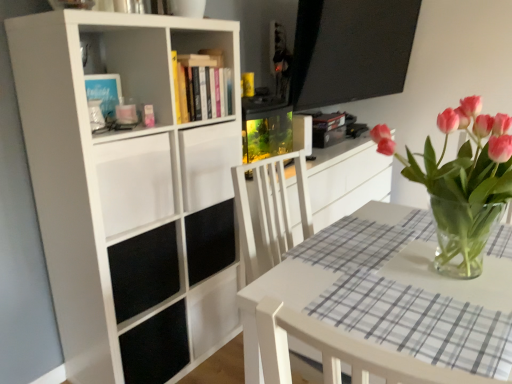
Question: Does hardcover books at upper center have a lesser width compared to white matte drawer at upper left?

Choices:
 (A) no
 (B) yes

Answer: (B)

Question: Is hardcover books at upper center further to the viewer compared to white matte drawer at upper left?

Choices:
 (A) yes
 (B) no

Answer: (A)

Question: Does hardcover books at upper center have a greater width compared to white matte drawer at upper left?

Choices:
 (A) no
 (B) yes

Answer: (A)

Question: Is white matte drawer at upper left inside hardcover books at upper center?

Choices:
 (A) no
 (B) yes

Answer: (A)

Question: Can you confirm if hardcover books at upper center is bigger than white matte drawer at upper left?

Choices:
 (A) yes
 (B) no

Answer: (B)

Question: Is hardcover books at upper center to the right of white matte drawer at upper left from the viewer's perspective?

Choices:
 (A) yes
 (B) no

Answer: (A)

Question: From the image's perspective, would you say white matte drawer at upper left is shown under hardcover books at upper center?

Choices:
 (A) yes
 (B) no

Answer: (A)

Question: Is white matte drawer at upper left placed right next to hardcover books at upper center?

Choices:
 (A) yes
 (B) no

Answer: (B)

Question: Would you consider white matte drawer at upper left to be distant from hardcover books at upper center?

Choices:
 (A) no
 (B) yes

Answer: (A)

Question: Is white matte drawer at upper left shorter than hardcover books at upper center?

Choices:
 (A) no
 (B) yes

Answer: (A)

Question: Can you confirm if white matte drawer at upper left is taller than hardcover books at upper center?

Choices:
 (A) no
 (B) yes

Answer: (B)

Question: Is white matte drawer at upper left at the left side of hardcover books at upper center?

Choices:
 (A) no
 (B) yes

Answer: (B)

Question: Does white matte bookcase at left have a greater width compared to pink glass vase at center?

Choices:
 (A) no
 (B) yes

Answer: (B)